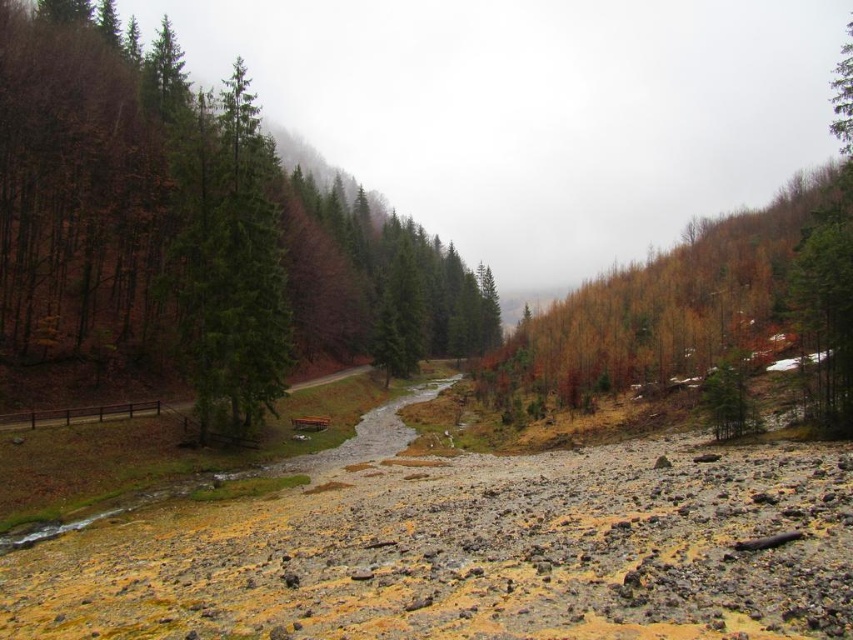
Question: Which of the following is the closest to the observer?

Choices:
 (A) (236, 177)
 (B) (231, 429)

Answer: (A)

Question: Is green matte tree at left to the right of green glossy tree at center from the viewer's perspective?

Choices:
 (A) yes
 (B) no

Answer: (B)

Question: Can you confirm if green matte tree at left is positioned above green glossy tree at center?

Choices:
 (A) no
 (B) yes

Answer: (B)

Question: Does green matte tree at left have a smaller size compared to green glossy tree at center?

Choices:
 (A) no
 (B) yes

Answer: (A)